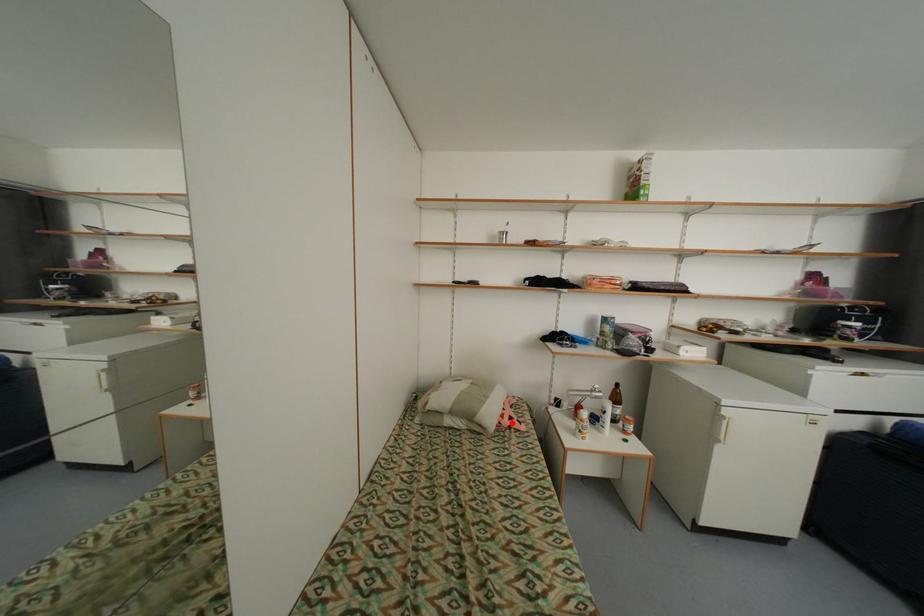
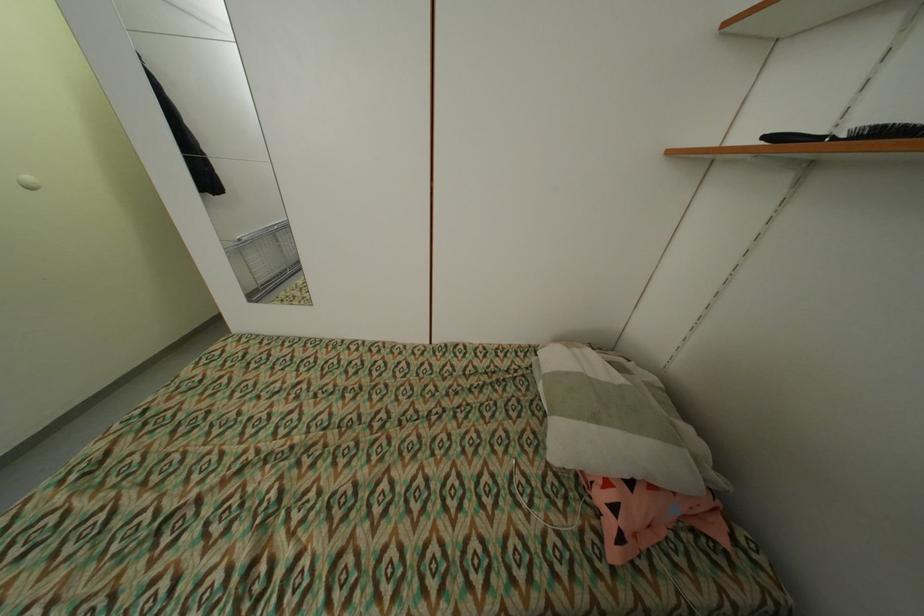
Question: I am providing you with two images of the same scene from different viewpoints. Image1 has a red point marked. In image2, the corresponding 3D location appears at what relative position? Reply with the corresponding letter.

Choices:
 (A) Closer
 (B) Farther

Answer: (A)